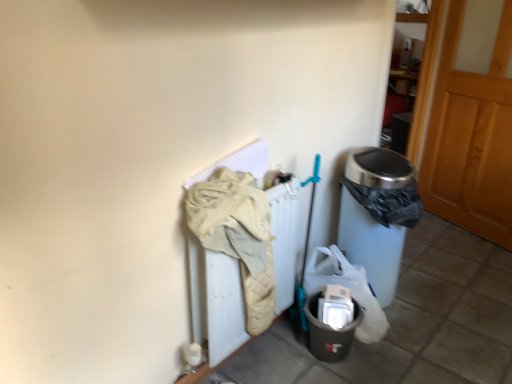
This screenshot has height=384, width=512. Describe the element at coordinates (238, 236) in the screenshot. I see `beige quilted blanket at center-left` at that location.

What are the coordinates of `beige quilted blanket at center-left` in the screenshot? It's located at (238, 236).

From a real-world perspective, is beige quilted blanket at center-left on top of wooden at right?

Incorrect, from a real-world perspective, beige quilted blanket at center-left is lower than wooden at right.

Which is nearer, (259, 300) or (433, 124)?

Point (259, 300)

From the image's perspective, is beige quilted blanket at center-left beneath wooden at right?

Yes, from the image's perspective, beige quilted blanket at center-left is beneath wooden at right.

Is beige quilted blanket at center-left facing towards wooden at right?

No, beige quilted blanket at center-left is not turned towards wooden at right.

Find the location of `recycling bin behind the beige quilted blanket at center-left`. recycling bin behind the beige quilted blanket at center-left is located at coordinates (329, 332).

How many degrees apart are the facing directions of matte gray plastic bin at lower right and beige quilted blanket at center-left?

matte gray plastic bin at lower right and beige quilted blanket at center-left are facing 0.00454 degrees away from each other.

Can we say matte gray plastic bin at lower right lies outside beige quilted blanket at center-left?

matte gray plastic bin at lower right is positioned outside beige quilted blanket at center-left.

Which of these two, wooden at right or beige quilted blanket at center-left, stands taller?

wooden at right.

From the image's perspective, between wooden at right and beige quilted blanket at center-left, which one is located above?

wooden at right.

Is wooden at right wider than beige quilted blanket at center-left?

Yes.

Consider the image. Is wooden at right next to beige quilted blanket at center-left and touching it?

wooden at right and beige quilted blanket at center-left are not in contact.

Could you tell me if beige quilted blanket at center-left is facing matte gray plastic bin at lower right?

Yes, beige quilted blanket at center-left is oriented towards matte gray plastic bin at lower right.

From the image's perspective, who appears lower, beige quilted blanket at center-left or matte gray plastic bin at lower right?

matte gray plastic bin at lower right.

Is beige quilted blanket at center-left wider or thinner than matte gray plastic bin at lower right?

Clearly, beige quilted blanket at center-left has less width compared to matte gray plastic bin at lower right.

Considering the sizes of objects beige quilted blanket at center-left and matte gray plastic bin at lower right in the image provided, who is shorter, beige quilted blanket at center-left or matte gray plastic bin at lower right?

With less height is matte gray plastic bin at lower right.

Measure the distance from wooden at right to matte gray plastic bin at lower right.

A distance of 4.89 feet exists between wooden at right and matte gray plastic bin at lower right.

Based on their sizes in the image, would you say wooden at right is bigger or smaller than matte gray plastic bin at lower right?

wooden at right is bigger than matte gray plastic bin at lower right.

Does point (507, 213) lie behind point (312, 333)?

Yes, it is behind point (312, 333).

From the image's perspective, who appears lower, wooden at right or matte gray plastic bin at lower right?

matte gray plastic bin at lower right.

In the scene shown: From a real-world perspective, which is physically above, matte gray plastic bin at lower right or wooden at right?

wooden at right.

Looking at this image, from the image's perspective, between matte gray plastic bin at lower right and wooden at right, which one is located above?

From the image's view, wooden at right is above.

Is matte gray plastic bin at lower right touching wooden at right?

They are not placed beside each other.

Can we say matte gray plastic bin at lower right lies outside wooden at right?

Yes, matte gray plastic bin at lower right is not within wooden at right.

Locate an element on the screen. This screenshot has height=384, width=512. door behind the beige quilted blanket at center-left is located at coordinates (472, 123).

This screenshot has width=512, height=384. There is a matte gray plastic bin at lower right. Find the location of `clothing above it (from a real-world perspective)`. clothing above it (from a real-world perspective) is located at coordinates (238, 236).

Considering their positions, is matte gray plastic bin at lower right positioned closer to beige quilted blanket at center-left than wooden at right?

matte gray plastic bin at lower right is closer to beige quilted blanket at center-left.

Based on their spatial positions, is matte gray plastic bin at lower right or beige quilted blanket at center-left closer to wooden at right?

Among the two, matte gray plastic bin at lower right is located nearer to wooden at right.

Based on their spatial positions, is wooden at right or matte gray plastic bin at lower right closer to beige quilted blanket at center-left?

The object closer to beige quilted blanket at center-left is matte gray plastic bin at lower right.

Looking at the image, which one is located further to matte gray plastic bin at lower right, wooden at right or beige quilted blanket at center-left?

wooden at right is further to matte gray plastic bin at lower right.

Estimate the real-world distances between objects in this image. Which object is closer to matte gray plastic bin at lower right, beige quilted blanket at center-left or wooden at right?

beige quilted blanket at center-left is closer to matte gray plastic bin at lower right.

Estimate the real-world distances between objects in this image. Which object is further from wooden at right, beige quilted blanket at center-left or matte gray plastic bin at lower right?

beige quilted blanket at center-left is positioned further to the anchor wooden at right.

You are a GUI agent. You are given a task and a screenshot of the screen. Output one action in this format:
    pyautogui.click(x=<x>, y=<y>)
    Task: Click on the recycling bin between beige quilted blanket at center-left and wooden at right from left to right
    The image size is (512, 384).
    Given the screenshot: What is the action you would take?
    pyautogui.click(x=329, y=332)